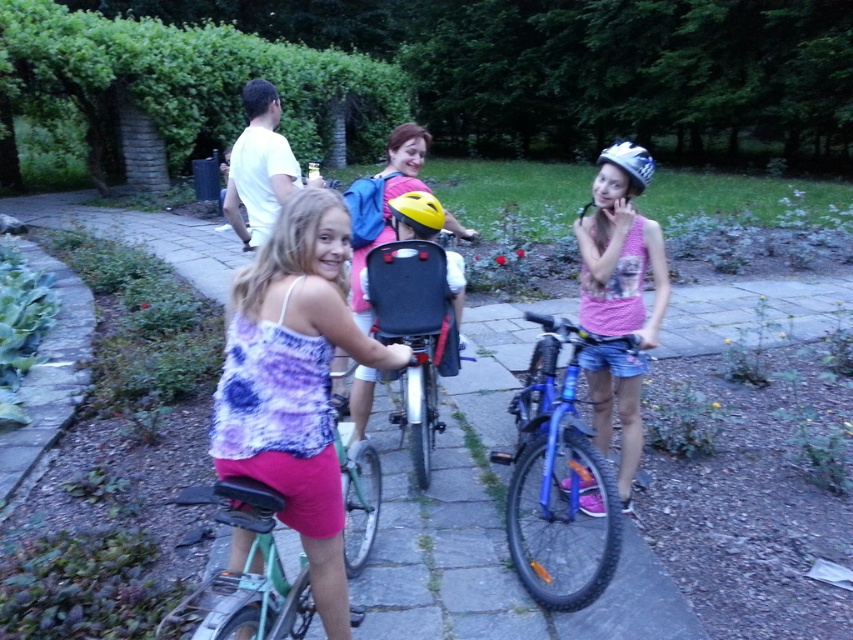
You are a delivery drone with a wingspan of 0.9 meters. You need to fly between the matte purple tank top at center and the green stone pavement at center. Can your drone fit through the space between them?

The distance between the matte purple tank top at center and the green stone pavement at center is 1.02 meters. Since your drone has a wingspan of 0.9 meters, it can fit through the space as the distance is slightly larger than the drone.

You are a photographer trying to capture a photo of the matte purple tank top at center and the green stone pavement at center. Based on their positions, which one is closer to the camera?

The matte purple tank top at center is above the green stone pavement at center, so it is closer to the camera.